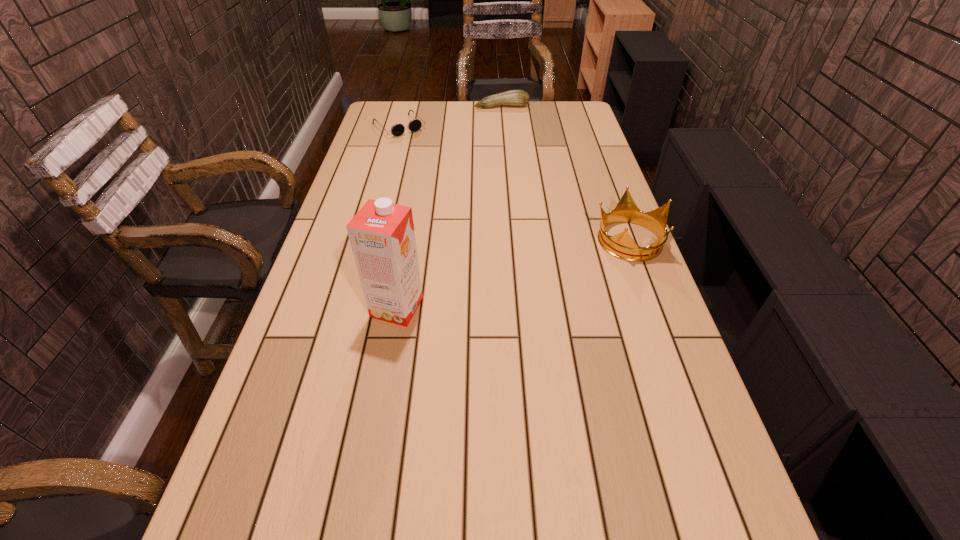
The width and height of the screenshot is (960, 540). What are the coordinates of `object present at the far left corner` in the screenshot? It's located at (414, 125).

This screenshot has height=540, width=960. In order to click on vacant space at the far edge of the desktop in this screenshot , I will do `click(451, 118)`.

In the image, there is a desktop. Find the location of `free region at the near edge`. free region at the near edge is located at coordinates (644, 504).

The image size is (960, 540). In order to click on free spot at the right edge of the desktop in this screenshot , I will do `click(592, 188)`.

The image size is (960, 540). I want to click on vacant area at the far left corner, so click(x=385, y=115).

Where is `vacant space at the near right corner of the desktop`? This screenshot has height=540, width=960. vacant space at the near right corner of the desktop is located at coordinates (716, 507).

Locate an element on the screen. vacant region between the second shortest object and the crown is located at coordinates (565, 173).

Find the location of a particular element. The width and height of the screenshot is (960, 540). unoccupied position between the third farthest object and the shortest object is located at coordinates (514, 183).

Locate an element on the screen. Image resolution: width=960 pixels, height=540 pixels. free spot between the third nearest object and the second tallest object is located at coordinates (514, 183).

Where is `free space between the rightmost object and the third object from left to right`? free space between the rightmost object and the third object from left to right is located at coordinates (565, 173).